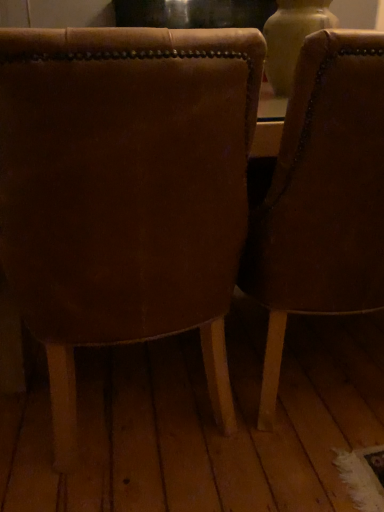
Question: Which direction should I rotate to look at leather chair at center, which ranks as the first chair in right-to-left order?

Choices:
 (A) right
 (B) left

Answer: (A)

Question: From a real-world perspective, is leather chair at center, placed as the second chair when sorted from left to right, on top of leather chair at center, which appears as the second chair when viewed from the right?

Choices:
 (A) yes
 (B) no

Answer: (B)

Question: Is leather chair at center, placed as the second chair when sorted from left to right, thinner than leather chair at center, which appears as the second chair when viewed from the right?

Choices:
 (A) yes
 (B) no

Answer: (A)

Question: Is leather chair at center, which ranks as the first chair in right-to-left order, looking in the opposite direction of leather chair at center, the first chair positioned from the left?

Choices:
 (A) yes
 (B) no

Answer: (B)

Question: Can you confirm if leather chair at center, which ranks as the first chair in right-to-left order, is wider than leather chair at center, which appears as the second chair when viewed from the right?

Choices:
 (A) no
 (B) yes

Answer: (A)

Question: Is leather chair at center, which ranks as the first chair in right-to-left order, taller than leather chair at center, the first chair positioned from the left?

Choices:
 (A) no
 (B) yes

Answer: (B)

Question: Is leather chair at center, which ranks as the first chair in right-to-left order, smaller than leather chair at center, which appears as the second chair when viewed from the right?

Choices:
 (A) no
 (B) yes

Answer: (B)

Question: Would you say leather chair at center, which ranks as the first chair in right-to-left order, is part of leather chair at center, which appears as the second chair when viewed from the right,'s contents?

Choices:
 (A) no
 (B) yes

Answer: (A)

Question: Is leather chair at center, which appears as the second chair when viewed from the right, next to leather chair at center, which ranks as the first chair in right-to-left order?

Choices:
 (A) yes
 (B) no

Answer: (B)

Question: Is leather chair at center, which appears as the second chair when viewed from the right, thinner than leather chair at center, which ranks as the first chair in right-to-left order?

Choices:
 (A) yes
 (B) no

Answer: (B)

Question: Considering the relative sizes of leather chair at center, which appears as the second chair when viewed from the right, and leather chair at center, placed as the second chair when sorted from left to right, in the image provided, is leather chair at center, which appears as the second chair when viewed from the right, shorter than leather chair at center, placed as the second chair when sorted from left to right,?

Choices:
 (A) no
 (B) yes

Answer: (B)

Question: Can you confirm if leather chair at center, which appears as the second chair when viewed from the right, is positioned to the right of leather chair at center, placed as the second chair when sorted from left to right?

Choices:
 (A) yes
 (B) no

Answer: (B)

Question: From a real-world perspective, is leather chair at center, which appears as the second chair when viewed from the right, on top of leather chair at center, placed as the second chair when sorted from left to right?

Choices:
 (A) no
 (B) yes

Answer: (B)

Question: From a real-world perspective, is leather chair at center, placed as the second chair when sorted from left to right, physically located above or below leather chair at center, the first chair positioned from the left?

Choices:
 (A) below
 (B) above

Answer: (A)